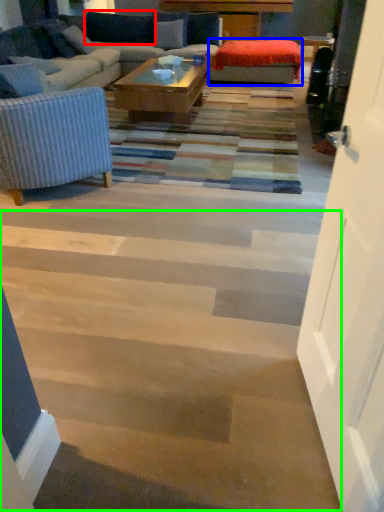
Question: Which is nearer to the pillow (highlighted by a red box)? wide (highlighted by a blue box) or stairwell (highlighted by a green box).

Choices:
 (A) wide
 (B) stairwell

Answer: (A)